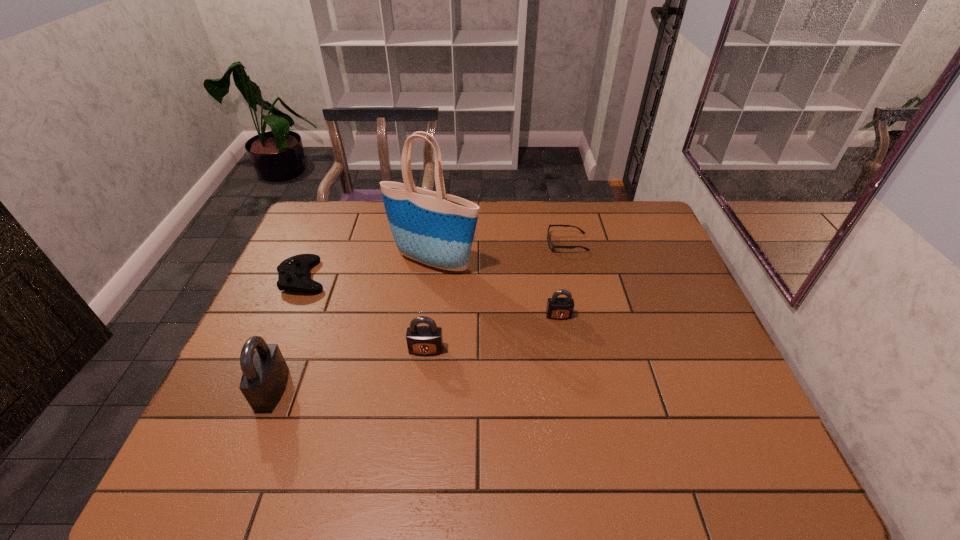
The image size is (960, 540). I want to click on free space located on the front of the third nearest object near the keyhole, so click(x=567, y=365).

At what (x,y) coordinates should I click in order to perform the action: click on vacant space located 0.090m on the right of the tote bag. Please return your answer as a coordinate pair (x, y). The height and width of the screenshot is (540, 960). Looking at the image, I should click on (508, 262).

The image size is (960, 540). Identify the location of blank area located on the front-facing side of the shortest object. (468, 243).

In order to click on free space located 0.210m on the front-facing side of the shortest object in this screenshot , I will do `click(484, 243)`.

The image size is (960, 540). What are the coordinates of `free space located on the front-facing side of the shortest object` in the screenshot? It's located at (439, 243).

Where is `free location located on the front of the control`? The image size is (960, 540). free location located on the front of the control is located at coordinates (261, 377).

Where is `object present at the far edge`? This screenshot has width=960, height=540. object present at the far edge is located at coordinates (550, 244).

The height and width of the screenshot is (540, 960). In order to click on object present at the near edge in this screenshot , I will do `click(265, 373)`.

Where is `padlock positioned at the left edge`? The width and height of the screenshot is (960, 540). padlock positioned at the left edge is located at coordinates (265, 373).

You are a GUI agent. You are given a task and a screenshot of the screen. Output one action in this format:
    pyautogui.click(x=<x>, y=<y>)
    Task: Click on the control at the left edge
    
    Given the screenshot: What is the action you would take?
    pyautogui.click(x=293, y=273)